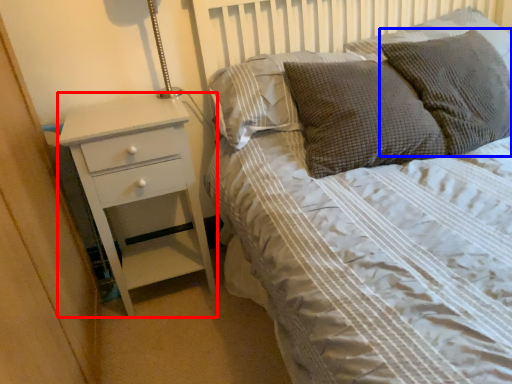
Question: Which point is further to the camera, chest of drawers (highlighted by a red box) or pillow (highlighted by a blue box)?

Choices:
 (A) chest of drawers
 (B) pillow

Answer: (A)